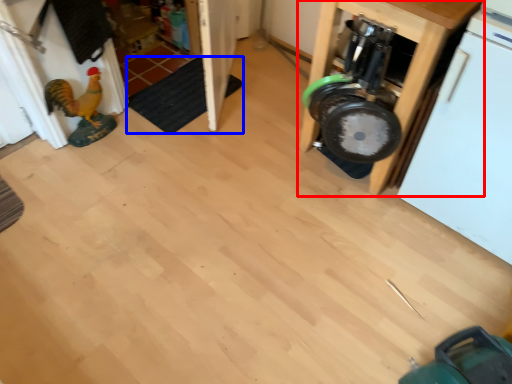
Question: Which object appears closest to the camera in this image, furniture (highlighted by a red box) or mat (highlighted by a blue box)?

Choices:
 (A) furniture
 (B) mat

Answer: (A)